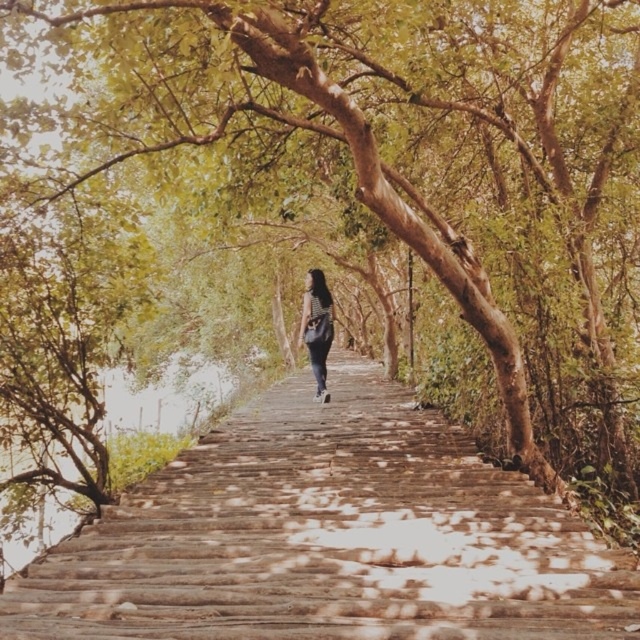
Question: Where is wooden stairs at center located in relation to striped fabric bag at center in the image?

Choices:
 (A) above
 (B) below

Answer: (B)

Question: In this image, where is wooden stairs at center located relative to striped fabric bag at center?

Choices:
 (A) left
 (B) right

Answer: (A)

Question: Which point appears closest to the camera in this image?

Choices:
 (A) (312, 272)
 (B) (577, 564)

Answer: (B)

Question: Which point is farther from the camera taking this photo?

Choices:
 (A) (316, 348)
 (B) (29, 616)

Answer: (A)

Question: Does wooden stairs at center appear over striped fabric bag at center?

Choices:
 (A) no
 (B) yes

Answer: (A)